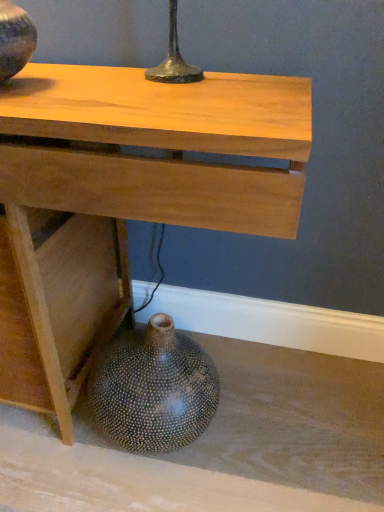
Identify the location of spots to the right of matte black vase at upper left, arranged as the first vase when viewed from the front. (85, 88).